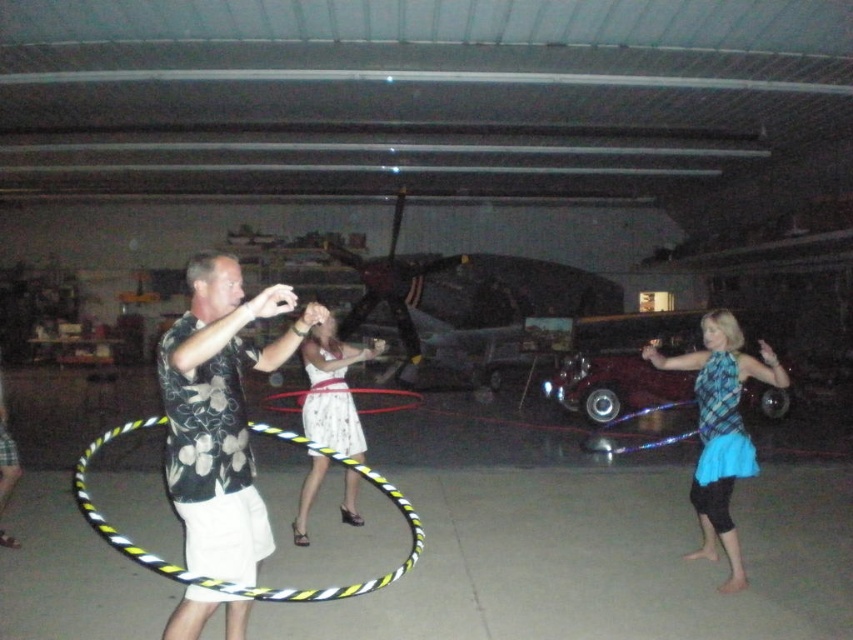
You are standing in the garage and see the blue plaid shirt at center and the yellow and black striped hula hoop at center. Which object is positioned to the right of the other?

The blue plaid shirt at center is to the right of the yellow and black striped hula hoop at center.

Based on the photo, you are planning to take a photo of the black floral shirt at center and the shiny maroon car at center in the dimly lit garage. Which object should you focus on first if you want to ensure both are in focus, considering their sizes?

The black floral shirt at center has a smaller size compared to the shiny maroon car at center. Therefore, you should focus on the shiny maroon car at center first since it is larger and will require more precise focusing to ensure both are in focus.

Based on the scene description, where is the yellow and black striped hula hoop at center located in terms of its 2D coordinates?

The yellow and black striped hula hoop at center is located at the 2D coordinates of point (234, 582).